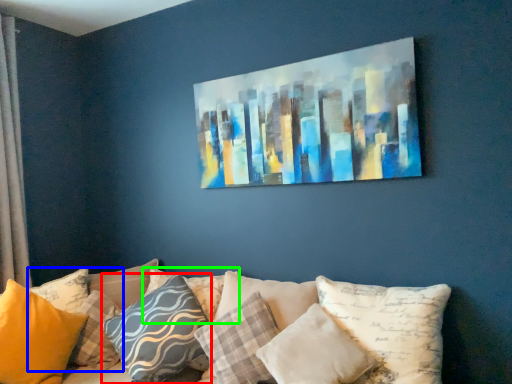
Question: Which is farther away from pillow (highlighted by a red box)? pillow (highlighted by a blue box) or pillow (highlighted by a green box)?

Choices:
 (A) pillow
 (B) pillow

Answer: (A)